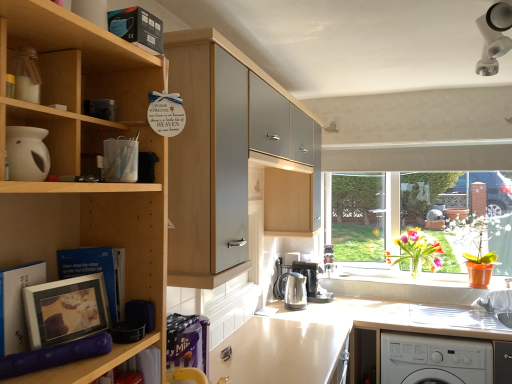
In order to face white plastic washing machine at lower right, should I rotate leftwards or rightwards?

It's best to rotate right around 22.519 degrees.

What do you see at coordinates (312, 282) in the screenshot?
I see `satin black coffee machine at lower center` at bounding box center [312, 282].

Where is `satin black coffee machine at lower center`? Image resolution: width=512 pixels, height=384 pixels. satin black coffee machine at lower center is located at coordinates (312, 282).

Describe the element at coordinates (390, 279) in the screenshot. This screenshot has height=384, width=512. I see `orange plastic pot at lower center` at that location.

Find the location of a particular element. The width and height of the screenshot is (512, 384). matte black book at lower left, the second book in the front-to-back sequence is located at coordinates (98, 272).

Considering the relative sizes of satin black coffee machine at lower center and matte white photo frame at lower left, the 2th book positioned from the back, in the image provided, is satin black coffee machine at lower center bigger than matte white photo frame at lower left, the 2th book positioned from the back,?

Yes, satin black coffee machine at lower center is bigger than matte white photo frame at lower left, the 2th book positioned from the back.

Is point (316, 293) closer or farther from the camera than point (19, 337)?

Point (316, 293).

From the image's perspective, which is above, satin black coffee machine at lower center or matte white photo frame at lower left, which ranks as the 1th book in front-to-back order?

matte white photo frame at lower left, which ranks as the 1th book in front-to-back order, from the image's perspective.

Is satin black coffee machine at lower center wider than matte white photo frame at lower left, the 2th book positioned from the back?

Yes, satin black coffee machine at lower center is wider than matte white photo frame at lower left, the 2th book positioned from the back.

Consider the image. Which object is wider, matte black book at lower left, the second book in the front-to-back sequence, or wooden cabinet at upper center?

With larger width is wooden cabinet at upper center.

From a real-world perspective, which object rests below the other?

matte black book at lower left, the second book in the front-to-back sequence, from a real-world perspective.

Based on the photo, is matte black book at lower left, the second book in the front-to-back sequence, in contact with wooden cabinet at upper center?

No.

Where is `window sill below the wooden cabinet at upper center (from a real-world perspective)`? The width and height of the screenshot is (512, 384). window sill below the wooden cabinet at upper center (from a real-world perspective) is located at coordinates (390, 279).

Which of these two, orange plastic pot at lower center or wooden cabinet at upper center, is wider?

wooden cabinet at upper center.

Is orange plastic pot at lower center taller than wooden cabinet at upper center?

No.

Considering the positions of objects orange plastic pot at lower center and wooden cabinet at upper center in the image provided, who is more to the right, orange plastic pot at lower center or wooden cabinet at upper center?

orange plastic pot at lower center.

Between polished stainless steel kettle at center and white plastic washing machine at lower right, which one has smaller width?

polished stainless steel kettle at center is thinner.

Can white plastic washing machine at lower right be found inside polished stainless steel kettle at center?

No, polished stainless steel kettle at center does not contain white plastic washing machine at lower right.

Is polished stainless steel kettle at center far from white plastic washing machine at lower right?

Actually, polished stainless steel kettle at center and white plastic washing machine at lower right are a little close together.

Is polished stainless steel kettle at center aimed at white plastic washing machine at lower right?

Yes, polished stainless steel kettle at center is turned towards white plastic washing machine at lower right.

From a real-world perspective, is orange plastic pot at lower center positioned above or below satin black coffee machine at lower center?

Clearly, from a real-world perspective, orange plastic pot at lower center is below satin black coffee machine at lower center.

Which of these two, orange plastic pot at lower center or satin black coffee machine at lower center, is thinner?

Thinner between the two is orange plastic pot at lower center.

Is point (441, 286) in front of point (311, 301)?

That is True.

Could satin black coffee machine at lower center be considered to be inside orange plastic pot at lower center?

No, satin black coffee machine at lower center is located outside of orange plastic pot at lower center.

How many degrees apart are the facing directions of light brown laminate counter top at center and white plastic washing machine at lower right?

The angle between the facing direction of light brown laminate counter top at center and the facing direction of white plastic washing machine at lower right is 89 degrees.

Where is `washing machine that is on the right side of light brown laminate counter top at center`? The image size is (512, 384). washing machine that is on the right side of light brown laminate counter top at center is located at coordinates (434, 359).

Is light brown laminate counter top at center smaller than white plastic washing machine at lower right?

Correct, light brown laminate counter top at center occupies less space than white plastic washing machine at lower right.

From the image's perspective, which one is positioned higher, light brown laminate counter top at center or polished stainless steel kettle at center?

polished stainless steel kettle at center.

Between light brown laminate counter top at center and polished stainless steel kettle at center, which one has more height?

With more height is light brown laminate counter top at center.

I want to click on kitchen appliance lying on the right of light brown laminate counter top at center, so (292, 290).

Is light brown laminate counter top at center oriented towards polished stainless steel kettle at center?

No, light brown laminate counter top at center does not turn towards polished stainless steel kettle at center.

Identify the location of coffee machine below the matte white photo frame at lower left, which ranks as the 1th book in front-to-back order (from a real-world perspective). This screenshot has height=384, width=512. (312, 282).

Locate an element on the screen. This screenshot has width=512, height=384. cabinetry that appears on the right of matte black book at lower left, the second book in the front-to-back sequence is located at coordinates (233, 158).

Estimate the real-world distances between objects in this image. Which object is further from matte black book at lower left, the second book in the front-to-back sequence, light brown laminate counter top at center or wooden cabinet at upper center?

light brown laminate counter top at center is positioned further to the anchor matte black book at lower left, the second book in the front-to-back sequence.

Based on their spatial positions, is orange plastic pot at lower center or matte purple foam roller at lower left further from matte black book at lower left, the 1th book viewed from the back?

orange plastic pot at lower center lies further to matte black book at lower left, the 1th book viewed from the back, than the other object.

Considering their positions, is orange plastic pot at window positioned further to polished stainless steel kettle at center than matte purple foam roller at lower left?

The object further to polished stainless steel kettle at center is matte purple foam roller at lower left.

Considering their positions, is orange plastic pot at window positioned further to white matte jar at upper left than vibrant glass vase at window?

orange plastic pot at window.

Based on the photo, which object lies further to the anchor point matte silver picture frame at left, matte purple foam roller at lower left or satin black coffee machine at lower center?

Based on the image, satin black coffee machine at lower center appears to be further to matte silver picture frame at left.

Estimate the real-world distances between objects in this image. Which object is closer to matte purple foam roller at lower left, wooden cabinet at upper center or matte silver picture frame at left?

Among the two, matte silver picture frame at left is located nearer to matte purple foam roller at lower left.

Based on their spatial positions, is light brown laminate counter top at center or satin black coffee machine at lower center further from matte purple foam roller at lower left?

satin black coffee machine at lower center lies further to matte purple foam roller at lower left than the other object.

Estimate the real-world distances between objects in this image. Which object is further from white plastic washing machine at lower right, matte silver picture frame at left or orange plastic pot at window?

matte silver picture frame at left is further to white plastic washing machine at lower right.

Identify the location of houseplant between white matte jar at upper left and satin black coffee machine at lower center from front to back. Image resolution: width=512 pixels, height=384 pixels. (482, 245).

Locate an element on the screen. The image size is (512, 384). window sill located between matte purple foam roller at lower left and satin black coffee machine at lower center in the depth direction is located at coordinates (390, 279).

At what (x,y) coordinates should I click in order to perform the action: click on book between matte purple foam roller at lower left and matte silver picture frame at left along the z-axis. Please return your answer as a coordinate pair (x, y). The image size is (512, 384). Looking at the image, I should click on (16, 305).

Locate an element on the screen. The width and height of the screenshot is (512, 384). window sill between white matte jar at upper left and satin black coffee machine at lower center along the z-axis is located at coordinates (390, 279).